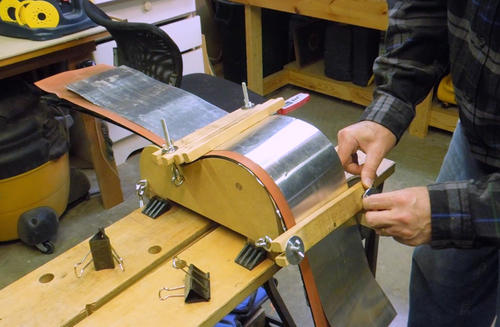
The image size is (500, 327). In order to click on drawers in this screenshot , I will do click(x=172, y=8), click(x=182, y=35), click(x=194, y=61).